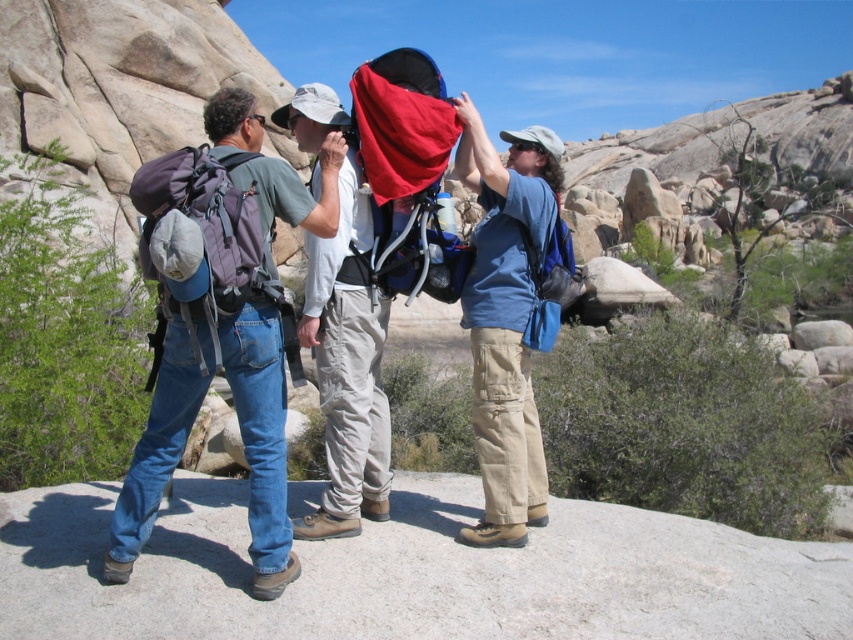
Is point (259, 148) less distant than point (524, 189)?

Yes, it is.

This screenshot has height=640, width=853. Describe the element at coordinates (221, 320) in the screenshot. I see `matte gray backpack at left` at that location.

The image size is (853, 640). I want to click on matte gray backpack at left, so click(x=221, y=320).

Measure the distance between blue fabric backpack at center and matte gray backpack at center.

blue fabric backpack at center is 19.29 feet away from matte gray backpack at center.

Is blue fabric backpack at center behind matte gray backpack at center?

Yes, blue fabric backpack at center is behind matte gray backpack at center.

The image size is (853, 640). I want to click on blue fabric backpack at center, so click(505, 317).

The height and width of the screenshot is (640, 853). Find the location of `blue fabric backpack at center`. blue fabric backpack at center is located at coordinates (505, 317).

Does matte gray backpack at left have a smaller size compared to matte gray backpack at center?

Yes, matte gray backpack at left is smaller than matte gray backpack at center.

Is the position of matte gray backpack at left less distant than that of matte gray backpack at center?

Yes, matte gray backpack at left is closer to the viewer.

Looking at this image, measure the distance between point (x=239, y=278) and camera.

Point (x=239, y=278) is 68.71 feet from camera.

Where is `matte gray backpack at left`? This screenshot has width=853, height=640. matte gray backpack at left is located at coordinates (221, 320).